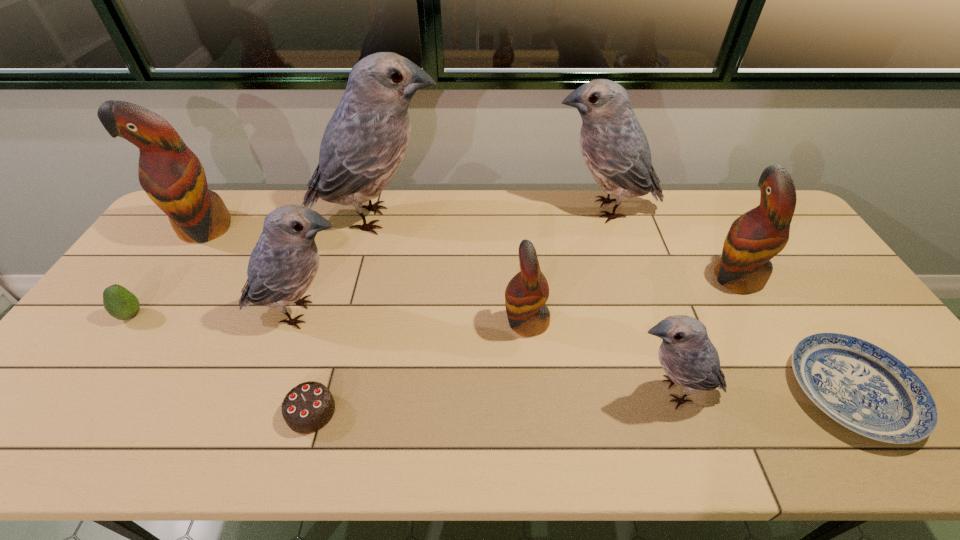
Identify the location of the tallest object. This screenshot has width=960, height=540. (365, 141).

Where is `the tallest parrot`? Image resolution: width=960 pixels, height=540 pixels. the tallest parrot is located at coordinates (365, 141).

In order to click on the second biggest gray parrot in this screenshot , I will do `click(615, 149)`.

In order to click on the biggest red parrot in this screenshot , I will do `click(173, 177)`.

Locate an element on the screen. the farthest red parrot is located at coordinates (173, 177).

This screenshot has height=540, width=960. I want to click on the rightmost red parrot, so click(x=754, y=238).

The height and width of the screenshot is (540, 960). Find the location of `the fourth farthest object`. the fourth farthest object is located at coordinates (754, 238).

The width and height of the screenshot is (960, 540). I want to click on the third farthest gray parrot, so click(285, 260).

The width and height of the screenshot is (960, 540). I want to click on the nearest parrot, so click(686, 354).

Identify the location of the smallest gray parrot. This screenshot has height=540, width=960. (686, 354).